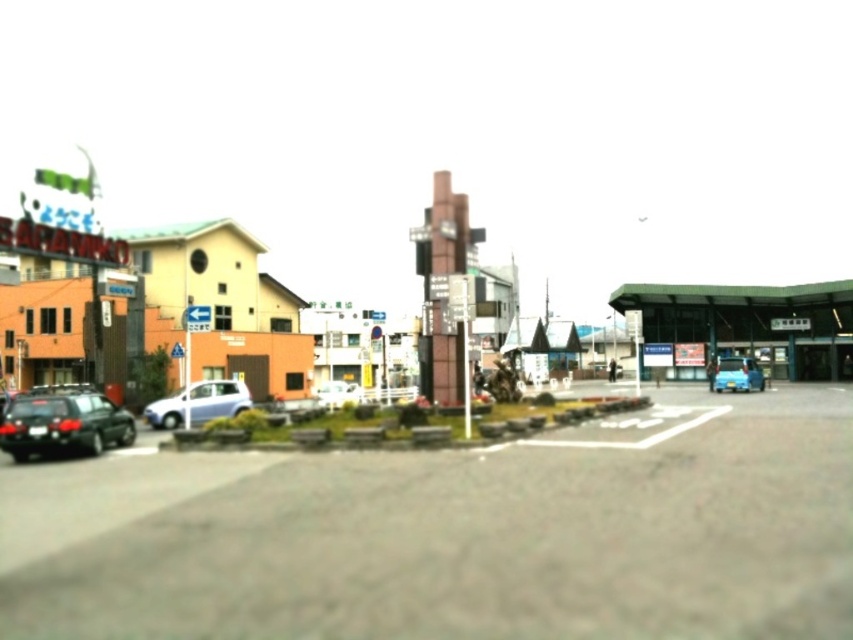
Between smooth asphalt parking lot at center and blue glossy car at lower right, which one has less height?

With less height is smooth asphalt parking lot at center.

Is smooth asphalt parking lot at center bigger than blue glossy car at lower right?

Yes.

Find the location of a particular element. This screenshot has height=640, width=853. smooth asphalt parking lot at center is located at coordinates (456, 532).

Between smooth asphalt parking lot at center and matte orange building at left, which one is positioned lower?

smooth asphalt parking lot at center

Does smooth asphalt parking lot at center have a lesser width compared to matte orange building at left?

Correct, smooth asphalt parking lot at center's width is less than matte orange building at left's.

At what (x,y) coordinates should I click in order to perform the action: click on smooth asphalt parking lot at center. Please return your answer as a coordinate pair (x, y). The image size is (853, 640). Looking at the image, I should click on (456, 532).

You are a GUI agent. You are given a task and a screenshot of the screen. Output one action in this format:
    pyautogui.click(x=<x>, y=<y>)
    Task: Click on the smooth asphalt parking lot at center
    The width and height of the screenshot is (853, 640).
    Given the screenshot: What is the action you would take?
    pyautogui.click(x=456, y=532)

Does matte orange building at left appear on the right side of blue glossy car at lower right?

Incorrect, matte orange building at left is not on the right side of blue glossy car at lower right.

Which of these two, matte orange building at left or blue glossy car at lower right, stands taller?

With more height is matte orange building at left.

Locate an element on the screen. This screenshot has height=640, width=853. matte orange building at left is located at coordinates (331, 307).